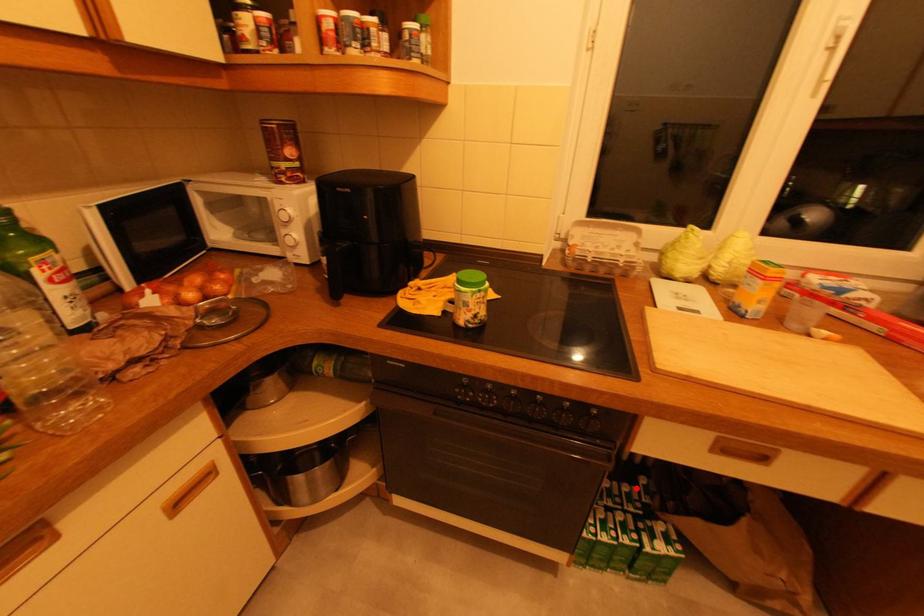
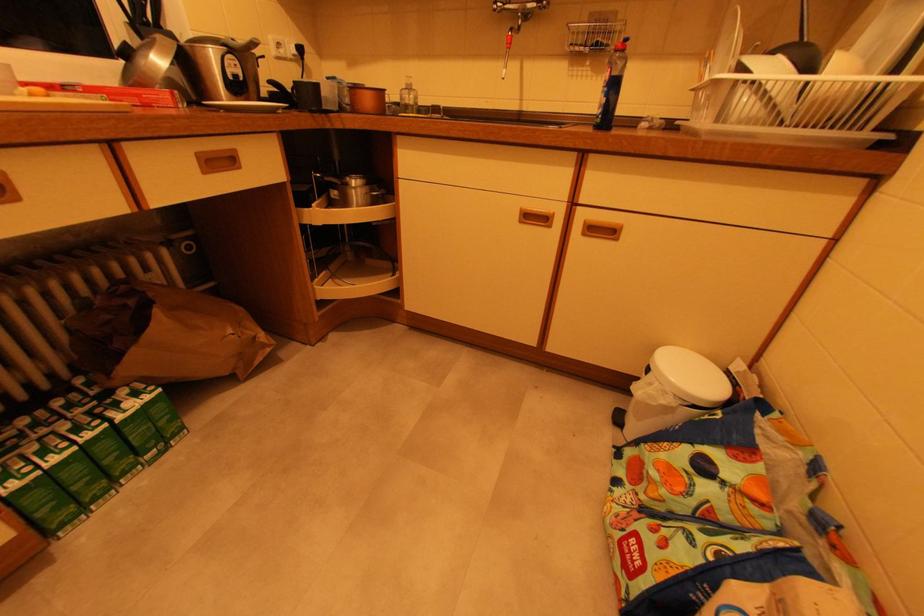
Question: I am providing you with two images of the same scene from different viewpoints. A red point is shown in image1. For the corresponding object point in image2, is it positioned nearer or farther from the camera?

Choices:
 (A) Nearer
 (B) Farther

Answer: (A)